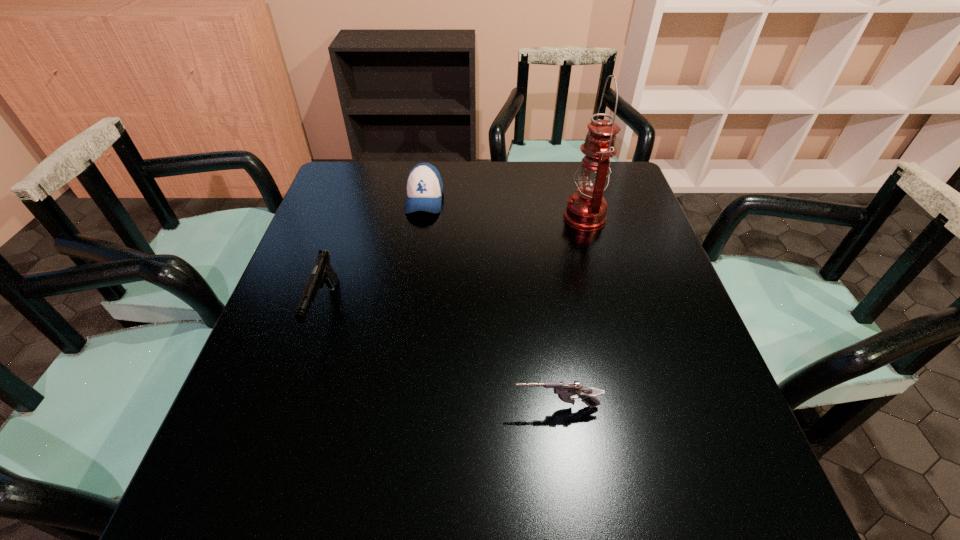
You are a GUI agent. You are given a task and a screenshot of the screen. Output one action in this format:
    pyautogui.click(x=<x>, y=<y>)
    Task: Click on the vacant area that lies between the left gun and the right gun
    The height and width of the screenshot is (540, 960).
    Given the screenshot: What is the action you would take?
    pyautogui.click(x=441, y=358)

Identify the location of vacant area that lies between the oil lamp and the second shortest object. click(505, 208).

Locate an element on the screen. The width and height of the screenshot is (960, 540). free point between the oil lamp and the second shortest object is located at coordinates (505, 208).

Find the location of `free spot between the leftmost object and the third object from right to left`. free spot between the leftmost object and the third object from right to left is located at coordinates (374, 254).

Where is `vacant area that lies between the taller gun and the second object from right to left`? vacant area that lies between the taller gun and the second object from right to left is located at coordinates (441, 358).

Where is `object that can be found as the second closest to the tallest object`? The height and width of the screenshot is (540, 960). object that can be found as the second closest to the tallest object is located at coordinates (565, 390).

I want to click on the closest object relative to the baseball cap, so click(323, 272).

I want to click on free space that satisfies the following two spatial constraints: 1. on the front-facing side of the oil lamp; 2. on the right side of the baseball cap, so click(421, 218).